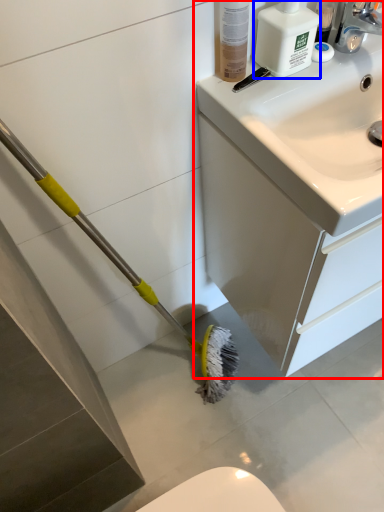
Question: Which point is closer to the camera, bathroom cabinet (highlighted by a red box) or cleaning product (highlighted by a blue box)?

Choices:
 (A) bathroom cabinet
 (B) cleaning product

Answer: (A)